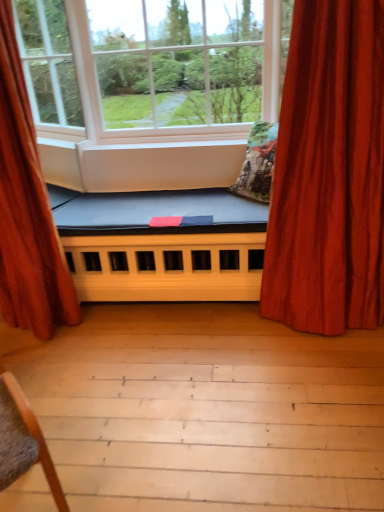
You are a GUI agent. You are given a task and a screenshot of the screen. Output one action in this format:
    pyautogui.click(x=<x>, y=<y>)
    Task: Click on the vacant space situated on the left part of velvet red curtain at right, arranged as the 2th curtain when viewed from the left
    The width and height of the screenshot is (384, 512).
    Given the screenshot: What is the action you would take?
    pyautogui.click(x=234, y=346)